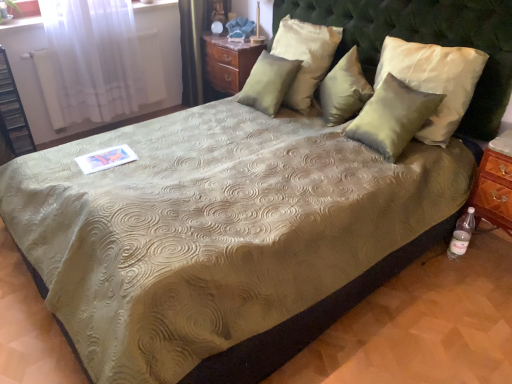
Locate an element on the screen. This screenshot has width=512, height=384. vacant area that is in front of clear plastic bottle at lower right is located at coordinates (463, 278).